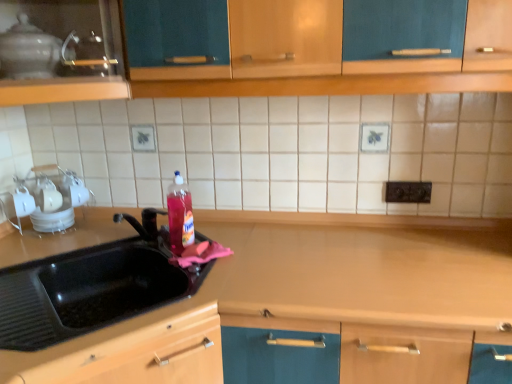
You are a GUI agent. You are given a task and a screenshot of the screen. Output one action in this format:
    pyautogui.click(x=<x>, y=<y>)
    Task: Click on the vacant area that lies to the right of white glossy dish rack at left, the first appliance from the bottom
    
    Given the screenshot: What is the action you would take?
    pyautogui.click(x=95, y=231)